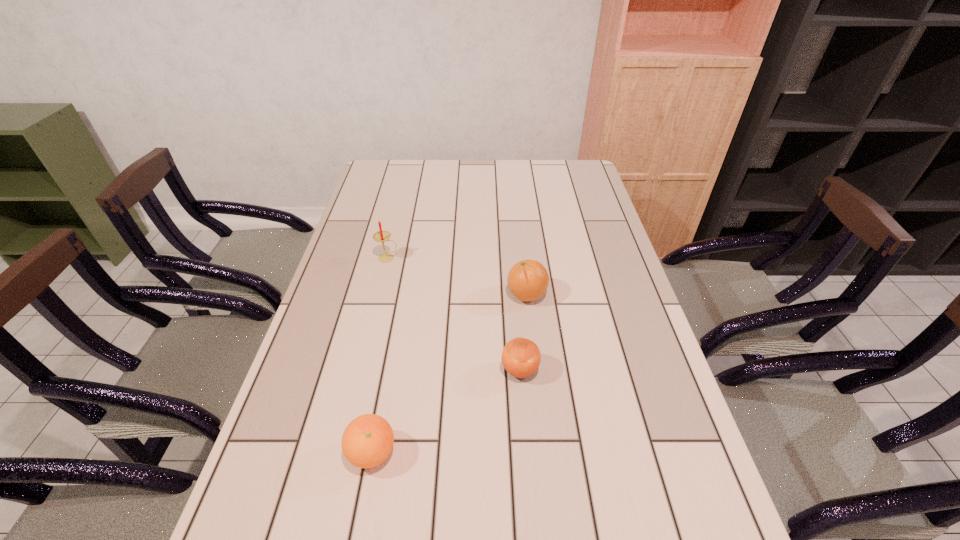
Identify the location of vacant area that satisfies the following two spatial constraints: 1. on the back side of the second nearest orange; 2. on the left side of the farthest orange. The height and width of the screenshot is (540, 960). (514, 294).